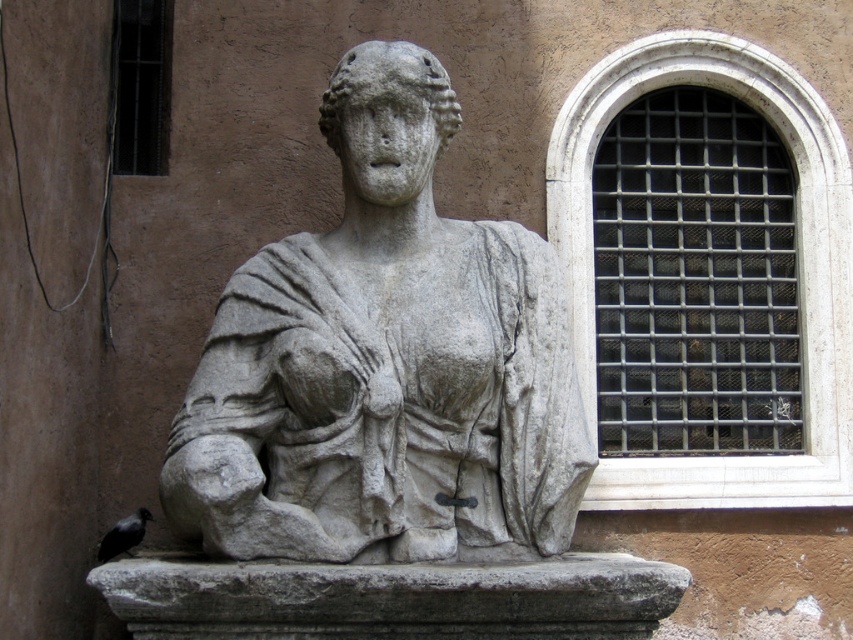
In the scene shown: Which is below, gray stone bust at center or metallic grid at upper left?

gray stone bust at center is below.

Is point (527, 353) in front of point (134, 83)?

That is True.

The height and width of the screenshot is (640, 853). What do you see at coordinates (386, 364) in the screenshot?
I see `gray stone bust at center` at bounding box center [386, 364].

This screenshot has width=853, height=640. Identify the location of gray stone bust at center. (386, 364).

Measure the distance between metallic grid window at upper right and metallic grid at upper left.

A distance of 7.36 meters exists between metallic grid window at upper right and metallic grid at upper left.

Describe the element at coordinates (798, 269) in the screenshot. Image resolution: width=853 pixels, height=640 pixels. I see `metallic grid window at upper right` at that location.

Locate an element on the screen. This screenshot has height=640, width=853. metallic grid window at upper right is located at coordinates 798,269.

Is point (421, 436) in front of point (824, 252)?

Yes, it is in front of point (824, 252).

Does point (425, 372) lie in front of point (572, 141)?

Yes, it is.

At what (x,y) coordinates should I click in order to perform the action: click on gray stone bust at center. Please return your answer as a coordinate pair (x, y). Image resolution: width=853 pixels, height=640 pixels. Looking at the image, I should click on (386, 364).